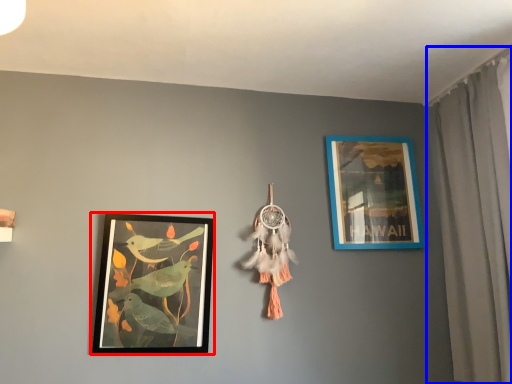
Question: Which point is further to the camera, picture frame (highlighted by a red box) or curtain (highlighted by a blue box)?

Choices:
 (A) picture frame
 (B) curtain

Answer: (A)